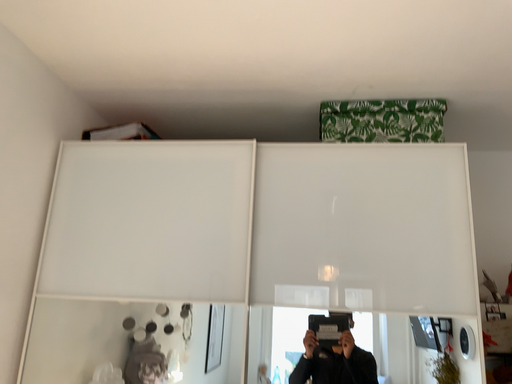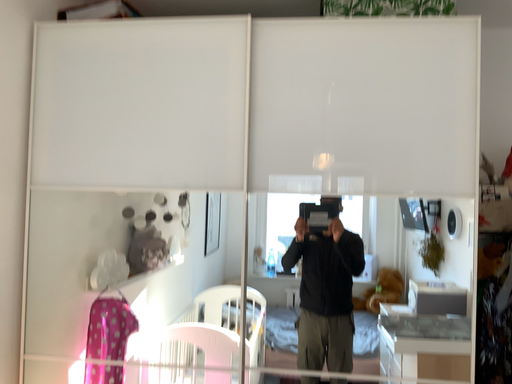
Question: Which way did the camera rotate in the video?

Choices:
 (A) rotated upward
 (B) rotated downward

Answer: (B)